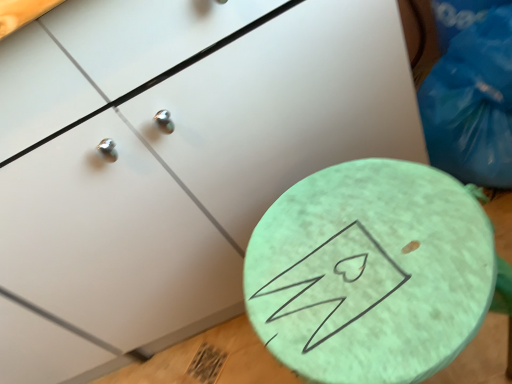
Question: Considering the relative positions of mint green textured table at center and blue plastic bag at upper right in the image provided, is mint green textured table at center to the left of blue plastic bag at upper right from the viewer's perspective?

Choices:
 (A) yes
 (B) no

Answer: (A)

Question: Can you confirm if mint green textured table at center is taller than blue plastic bag at upper right?

Choices:
 (A) no
 (B) yes

Answer: (B)

Question: Is mint green textured table at center to the right of blue plastic bag at upper right from the viewer's perspective?

Choices:
 (A) no
 (B) yes

Answer: (A)

Question: Is mint green textured table at center not inside blue plastic bag at upper right?

Choices:
 (A) no
 (B) yes

Answer: (B)

Question: From a real-world perspective, is mint green textured table at center physically below blue plastic bag at upper right?

Choices:
 (A) yes
 (B) no

Answer: (A)

Question: Considering the relative sizes of mint green textured table at center and blue plastic bag at upper right in the image provided, is mint green textured table at center shorter than blue plastic bag at upper right?

Choices:
 (A) no
 (B) yes

Answer: (A)

Question: Considering the relative sizes of blue plastic bag at upper right and mint green textured table at center in the image provided, is blue plastic bag at upper right shorter than mint green textured table at center?

Choices:
 (A) no
 (B) yes

Answer: (B)

Question: Is blue plastic bag at upper right oriented towards mint green textured table at center?

Choices:
 (A) yes
 (B) no

Answer: (B)

Question: Is blue plastic bag at upper right placed right next to mint green textured table at center?

Choices:
 (A) yes
 (B) no

Answer: (B)

Question: Considering the relative sizes of blue plastic bag at upper right and mint green textured table at center in the image provided, is blue plastic bag at upper right thinner than mint green textured table at center?

Choices:
 (A) no
 (B) yes

Answer: (B)

Question: Can you confirm if blue plastic bag at upper right is positioned to the right of mint green textured table at center?

Choices:
 (A) yes
 (B) no

Answer: (A)

Question: Can you confirm if blue plastic bag at upper right is taller than mint green textured table at center?

Choices:
 (A) yes
 (B) no

Answer: (B)

Question: Would you say mint green textured table at center is inside or outside blue plastic bag at upper right?

Choices:
 (A) outside
 (B) inside

Answer: (A)